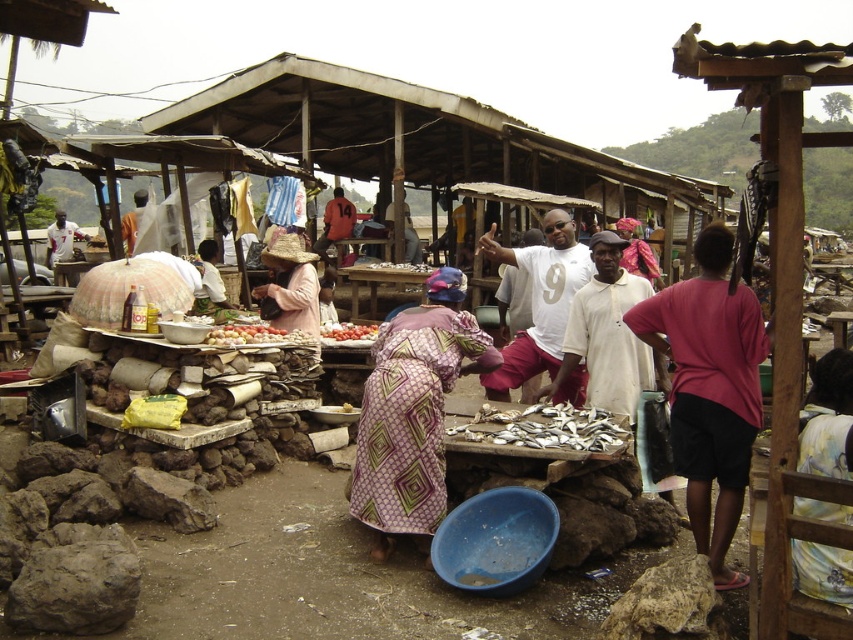
Question: Does purple printed fabric at center have a lesser width compared to smooth red tomatoes at center?

Choices:
 (A) yes
 (B) no

Answer: (B)

Question: Which object is the closest to the silver metallic fish at center?

Choices:
 (A) smooth red tomatoes at center
 (B) purple printed fabric at center

Answer: (B)

Question: Where is pink fabric shirt at right located in relation to silver metallic fish at center in the image?

Choices:
 (A) below
 (B) above

Answer: (B)

Question: Based on their relative distances, which object is farther from the silver metallic fish at center?

Choices:
 (A) ripe tomato at center
 (B) purple printed fabric at center

Answer: (A)

Question: Based on their relative distances, which object is farther from the pink fabric shirt at right?

Choices:
 (A) purple printed fabric at center
 (B) ripe tomato at center
 (C) smooth red tomatoes at center
 (D) silver metallic fish at center

Answer: (B)

Question: Does purple printed fabric at center have a lesser width compared to silver metallic fish at center?

Choices:
 (A) yes
 (B) no

Answer: (A)